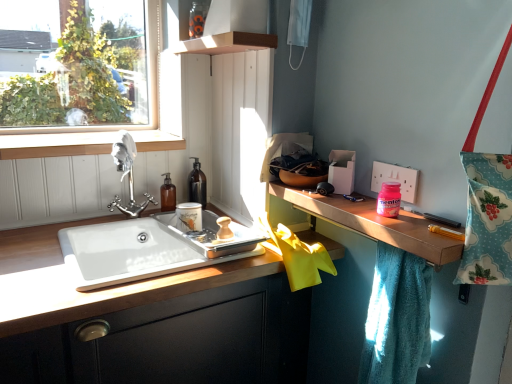
Where is `vacant space to the left of pink glossy mentos at upper right, the first toiletry from the front`? This screenshot has width=512, height=384. vacant space to the left of pink glossy mentos at upper right, the first toiletry from the front is located at coordinates (352, 209).